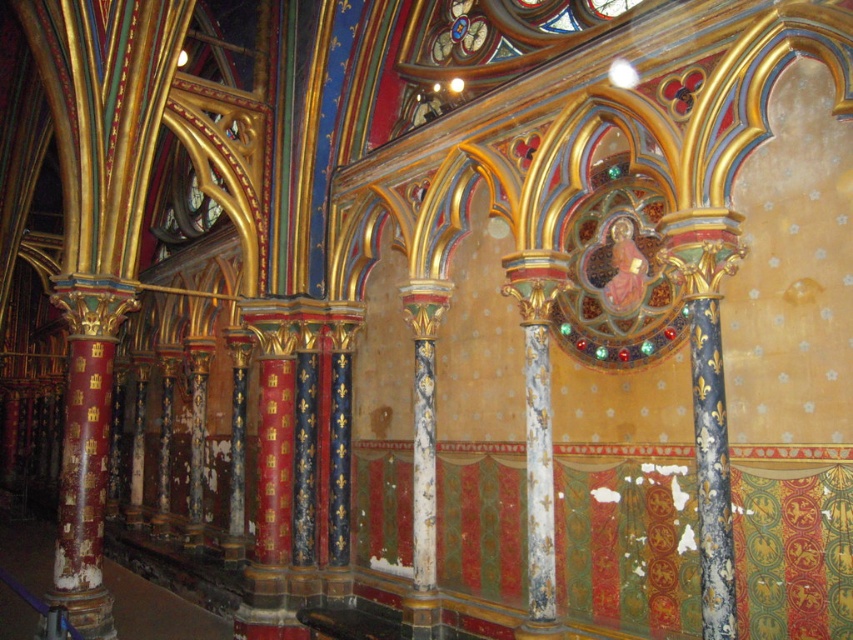
You are an architect visiting this ornate building and notice two columns in the center. One is a white painted wood column at center and the other is a white painted stone column at center. Which column is shorter?

The white painted wood column at center is shorter than the white painted stone column at center.

You are an architect designing a new cathedral and need to ensure that the columns in the nave are spaced at least 20 feet apart for structural stability. You observe the white painted wood column at center and the white painted stone column at center in the image. Based on the spacing between these two columns, will the design meet the minimum distance requirement?

The distance between the white painted wood column at center and the white painted stone column at center is 21.91 feet, which exceeds the required 20 feet, so the design meets the structural stability requirement.